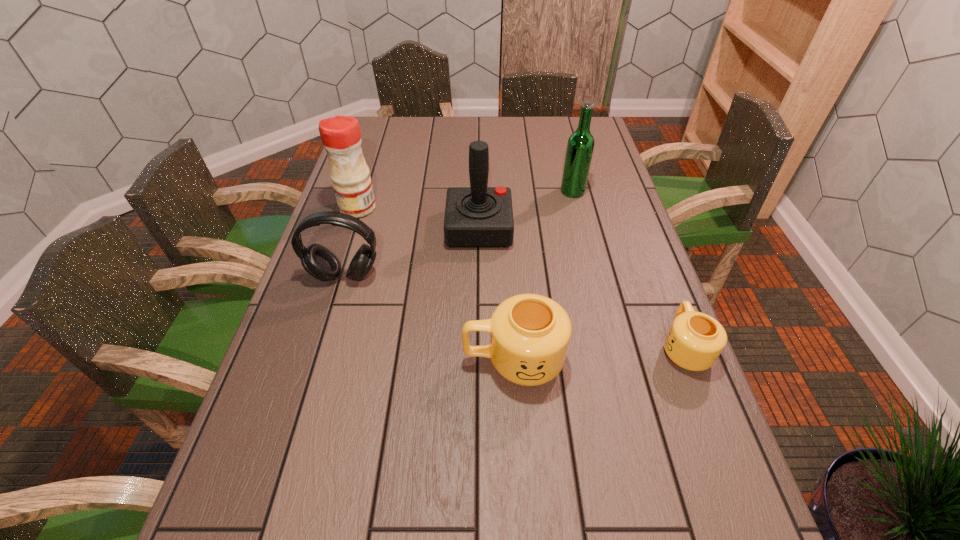
The image size is (960, 540). I want to click on free space located on the handle side of the taller mug, so click(357, 360).

The height and width of the screenshot is (540, 960). I want to click on vacant space located on the handle side of the taller mug, so click(290, 360).

At what (x,y) coordinates should I click in order to perform the action: click on free space located 0.280m on the handle side of the shortest object. Please return your answer as a coordinate pair (x, y). The height and width of the screenshot is (540, 960). Looking at the image, I should click on (644, 245).

The image size is (960, 540). I want to click on vacant region located on the handle side of the shortest object, so [x=664, y=297].

Where is `vacant space located on the handle side of the shortest object`? The image size is (960, 540). vacant space located on the handle side of the shortest object is located at coordinates (651, 262).

Identify the location of vacant point located on the back of the condiment. (372, 165).

Locate an element on the screen. This screenshot has width=960, height=540. free space located on the base of the joystick is located at coordinates (588, 228).

The height and width of the screenshot is (540, 960). Identify the location of vacant point located 0.080m on the back of the fifth object from left to right. (567, 171).

The height and width of the screenshot is (540, 960). What are the coordinates of `vacant space located 0.270m on the earcups of the fourth tallest object` in the screenshot? It's located at (315, 379).

The height and width of the screenshot is (540, 960). Find the location of `condiment that is at the left edge`. condiment that is at the left edge is located at coordinates (341, 137).